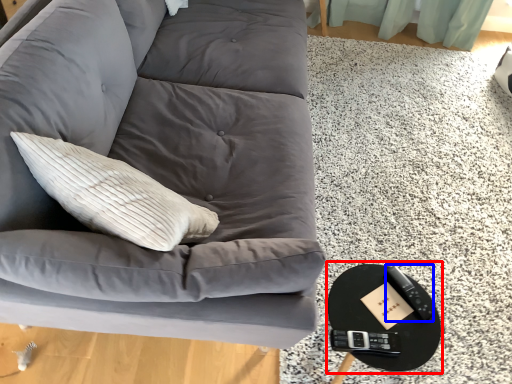
Question: Which object is further to the camera taking this photo, round table (highlighted by a red box) or remote (highlighted by a blue box)?

Choices:
 (A) round table
 (B) remote

Answer: (B)